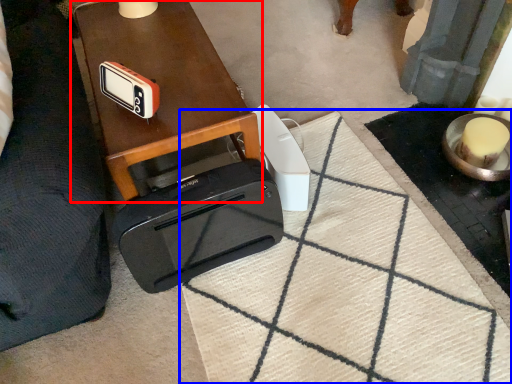
Question: Which object appears farthest to the camera in this image, table (highlighted by a red box) or doormat (highlighted by a blue box)?

Choices:
 (A) table
 (B) doormat

Answer: (A)